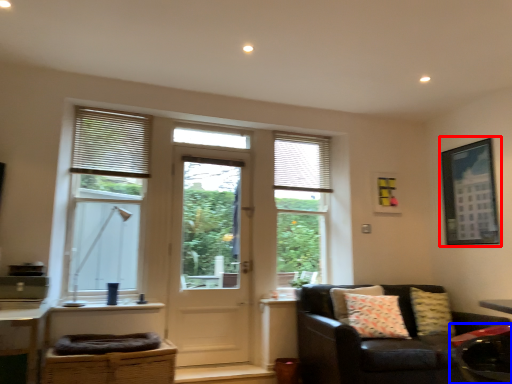
Question: Which of the following is the farthest to the observer, picture frame (highlighted by a red box) or swivel chair (highlighted by a blue box)?

Choices:
 (A) picture frame
 (B) swivel chair

Answer: (A)